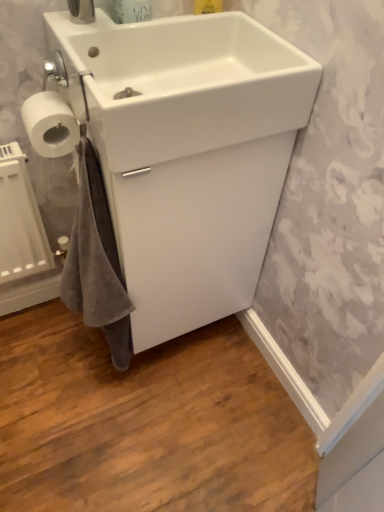
This screenshot has height=512, width=384. What are the coordinates of `white matte toilet paper at left` in the screenshot? It's located at (50, 124).

Describe the element at coordinates (187, 153) in the screenshot. Image resolution: width=384 pixels, height=512 pixels. I see `white glossy sink at center, marked as the second sink in a front-to-back arrangement` at that location.

This screenshot has height=512, width=384. In order to click on white matte toilet paper at left in this screenshot , I will do `click(50, 124)`.

Image resolution: width=384 pixels, height=512 pixels. What are the coordinates of `toilet paper below the white glossy sink at upper center, the 2th sink in the back-to-front sequence (from a real-world perspective)` in the screenshot? It's located at (50, 124).

Would you say white matte toilet paper at left is a long distance from white glossy sink at upper center, the 2th sink in the back-to-front sequence?

No, white matte toilet paper at left is not far away from white glossy sink at upper center, the 2th sink in the back-to-front sequence.

From a real-world perspective, is white matte toilet paper at left located higher than white glossy sink at upper center, the 1th sink viewed from the front?

No, from a real-world perspective, white matte toilet paper at left is not above white glossy sink at upper center, the 1th sink viewed from the front.

Considering their positions, is white matte toilet paper at left located in front of or behind white glossy sink at upper center, the 1th sink viewed from the front?

white matte toilet paper at left is positioned farther from the viewer than white glossy sink at upper center, the 1th sink viewed from the front.

Considering the sizes of white glossy sink at upper center, the 2th sink in the back-to-front sequence, and white glossy sink at center, the 1th sink when ordered from back to front, in the image, is white glossy sink at upper center, the 2th sink in the back-to-front sequence, bigger or smaller than white glossy sink at center, the 1th sink when ordered from back to front,?

Considering their sizes, white glossy sink at upper center, the 2th sink in the back-to-front sequence, takes up less space than white glossy sink at center, the 1th sink when ordered from back to front.

Is white glossy sink at upper center, the 1th sink viewed from the front, shorter than white glossy sink at center, the 1th sink when ordered from back to front?

Yes.

Does white glossy sink at upper center, the 1th sink viewed from the front, touch white glossy sink at center, marked as the second sink in a front-to-back arrangement?

Absolutely, white glossy sink at upper center, the 1th sink viewed from the front, is next to and touching white glossy sink at center, marked as the second sink in a front-to-back arrangement.

Which object is wider, white glossy sink at upper center, the 2th sink in the back-to-front sequence, or white glossy sink at center, the 1th sink when ordered from back to front?

white glossy sink at center, the 1th sink when ordered from back to front.

From a real-world perspective, relative to white matte toilet paper at left, is white glossy sink at upper center, the 1th sink viewed from the front, vertically above or below?

From a real-world perspective, white glossy sink at upper center, the 1th sink viewed from the front, is physically above white matte toilet paper at left.

Is the depth of white glossy sink at upper center, the 2th sink in the back-to-front sequence, less than that of white matte toilet paper at left?

Yes.

Who is bigger, white glossy sink at upper center, the 1th sink viewed from the front, or white matte toilet paper at left?

white glossy sink at upper center, the 1th sink viewed from the front, is bigger.

From the picture: How different are the orientations of white glossy sink at upper center, the 1th sink viewed from the front, and white matte toilet paper at left in degrees?

They differ by 90 degrees in their facing directions.

In terms of height, does white matte toilet paper at left look taller or shorter compared to white glossy sink at center, the 1th sink when ordered from back to front?

Clearly, white matte toilet paper at left is shorter compared to white glossy sink at center, the 1th sink when ordered from back to front.

Is point (31, 109) closer to camera compared to point (150, 128)?

No, it is not.

From a real-world perspective, is white matte toilet paper at left above or below white glossy sink at center, marked as the second sink in a front-to-back arrangement?

white matte toilet paper at left is above white glossy sink at center, marked as the second sink in a front-to-back arrangement.

Is white matte toilet paper at left located outside white glossy sink at center, the 1th sink when ordered from back to front?

Indeed, white matte toilet paper at left is completely outside white glossy sink at center, the 1th sink when ordered from back to front.

In the scene shown: Between white glossy sink at center, marked as the second sink in a front-to-back arrangement, and white glossy sink at upper center, the 2th sink in the back-to-front sequence, which one has larger size?

Result: With larger size is white glossy sink at center, marked as the second sink in a front-to-back arrangement.

From the image's perspective, which one is positioned lower, white glossy sink at center, marked as the second sink in a front-to-back arrangement, or white glossy sink at upper center, the 2th sink in the back-to-front sequence?

white glossy sink at center, marked as the second sink in a front-to-back arrangement, from the image's perspective.

Identify the location of sink behind the white glossy sink at upper center, the 2th sink in the back-to-front sequence. (187, 153).

Is white glossy sink at center, marked as the second sink in a front-to-back arrangement, positioned before white glossy sink at upper center, the 1th sink viewed from the front?

No, it is behind white glossy sink at upper center, the 1th sink viewed from the front.

Does point (126, 105) appear closer or farther from the camera than point (63, 128)?

Point (126, 105).

Considering the sizes of objects white glossy sink at center, the 1th sink when ordered from back to front, and white matte toilet paper at left in the image provided, who is wider, white glossy sink at center, the 1th sink when ordered from back to front, or white matte toilet paper at left?

Wider between the two is white glossy sink at center, the 1th sink when ordered from back to front.

From the image's perspective, which is above, white glossy sink at center, the 1th sink when ordered from back to front, or white matte toilet paper at left?

white matte toilet paper at left.

From a real-world perspective, who is located lower, white glossy sink at center, marked as the second sink in a front-to-back arrangement, or white matte toilet paper at left?

white glossy sink at center, marked as the second sink in a front-to-back arrangement, from a real-world perspective.

Image resolution: width=384 pixels, height=512 pixels. I want to click on the 2nd sink to the right when counting from the white matte toilet paper at left, so click(182, 84).

Identify the location of sink that is behind the white glossy sink at upper center, the 2th sink in the back-to-front sequence. (187, 153).

When comparing their distances from white matte toilet paper at left, does white glossy sink at upper center, the 2th sink in the back-to-front sequence, or white glossy sink at center, the 1th sink when ordered from back to front, seem closer?

white glossy sink at upper center, the 2th sink in the back-to-front sequence, lies closer to white matte toilet paper at left than the other object.

Which object lies nearer to the anchor point white glossy sink at upper center, the 1th sink viewed from the front, white matte toilet paper at left or white glossy sink at center, marked as the second sink in a front-to-back arrangement?

Based on the image, white glossy sink at center, marked as the second sink in a front-to-back arrangement, appears to be nearer to white glossy sink at upper center, the 1th sink viewed from the front.

Estimate the real-world distances between objects in this image. Which object is further from white matte toilet paper at left, white glossy sink at center, the 1th sink when ordered from back to front, or white glossy sink at upper center, the 1th sink viewed from the front?

white glossy sink at center, the 1th sink when ordered from back to front.

When comparing their distances from white glossy sink at center, the 1th sink when ordered from back to front, does white glossy sink at upper center, the 1th sink viewed from the front, or white matte toilet paper at left seem further?

white matte toilet paper at left.

Considering their positions, is white matte toilet paper at left positioned further to white glossy sink at center, the 1th sink when ordered from back to front, than white glossy sink at upper center, the 2th sink in the back-to-front sequence?

white matte toilet paper at left is positioned further to the anchor white glossy sink at center, the 1th sink when ordered from back to front.

Which object lies further to the anchor point white glossy sink at upper center, the 1th sink viewed from the front, white glossy sink at center, the 1th sink when ordered from back to front, or white matte toilet paper at left?

Based on the image, white matte toilet paper at left appears to be further to white glossy sink at upper center, the 1th sink viewed from the front.

Locate an element on the screen. Image resolution: width=384 pixels, height=512 pixels. sink between white matte toilet paper at left and white glossy sink at upper center, the 1th sink viewed from the front is located at coordinates (187, 153).